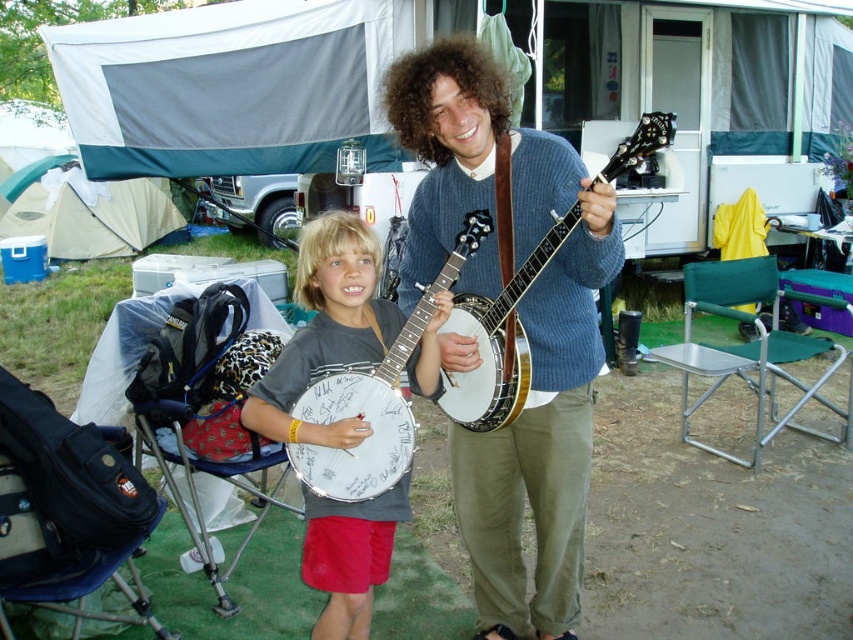
In the scene shown: Can you confirm if white wooden banjo at center is positioned to the right of white wood banjo at center?

No, white wooden banjo at center is not to the right of white wood banjo at center.

Who is higher up, white wooden banjo at center or white wood banjo at center?

white wood banjo at center is higher up.

Who is more forward, (466, 236) or (453, 419)?

Positioned in front is point (466, 236).

The image size is (853, 640). Identify the location of white wooden banjo at center. (374, 401).

Who is higher up, blue fabric folding chair at lower left or green fabric folding chair at lower right?

green fabric folding chair at lower right is higher up.

Is blue fabric folding chair at lower left to the right of green fabric folding chair at lower right from the viewer's perspective?

Incorrect, blue fabric folding chair at lower left is not on the right side of green fabric folding chair at lower right.

Which is behind, point (241, 323) or point (688, 298)?

The point (688, 298) is more distant.

Locate an element on the screen. Image resolution: width=853 pixels, height=640 pixels. blue fabric folding chair at lower left is located at coordinates (206, 406).

Is green fabric folding chair at lower right below white wooden banjo at center?

Yes, green fabric folding chair at lower right is below white wooden banjo at center.

Can you confirm if green fabric folding chair at lower right is shorter than white wooden banjo at center?

Incorrect, green fabric folding chair at lower right's height does not fall short of white wooden banjo at center's.

Locate an element on the screen. green fabric folding chair at lower right is located at coordinates (751, 349).